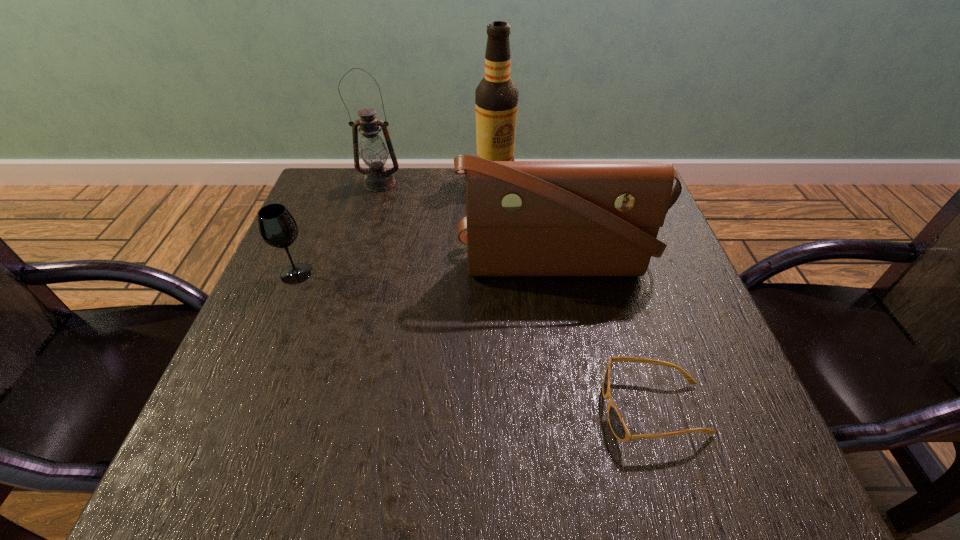
Where is `the tallest object`? This screenshot has width=960, height=540. the tallest object is located at coordinates (496, 98).

This screenshot has width=960, height=540. Identify the location of oil lamp. (373, 151).

Identify the location of satchel. The height and width of the screenshot is (540, 960). (523, 218).

At what (x,y) coordinates should I click in order to perform the action: click on the leftmost object. Please return your answer as a coordinate pair (x, y). The height and width of the screenshot is (540, 960). Looking at the image, I should click on (277, 227).

In order to click on the second shortest object in this screenshot , I will do `click(277, 227)`.

This screenshot has height=540, width=960. I want to click on the shortest object, so click(618, 427).

The image size is (960, 540). I want to click on the nearest object, so click(618, 427).

At what (x,y) coordinates should I click in order to perform the action: click on vacant region located on the label of the alcohol. Please return your answer as a coordinate pair (x, y). This screenshot has height=540, width=960. Looking at the image, I should click on (498, 252).

Identify the location of free space located on the right of the fourth object from right to left. The image size is (960, 540). (455, 183).

The width and height of the screenshot is (960, 540). I want to click on free space located on the front flap of the satchel, so click(x=566, y=331).